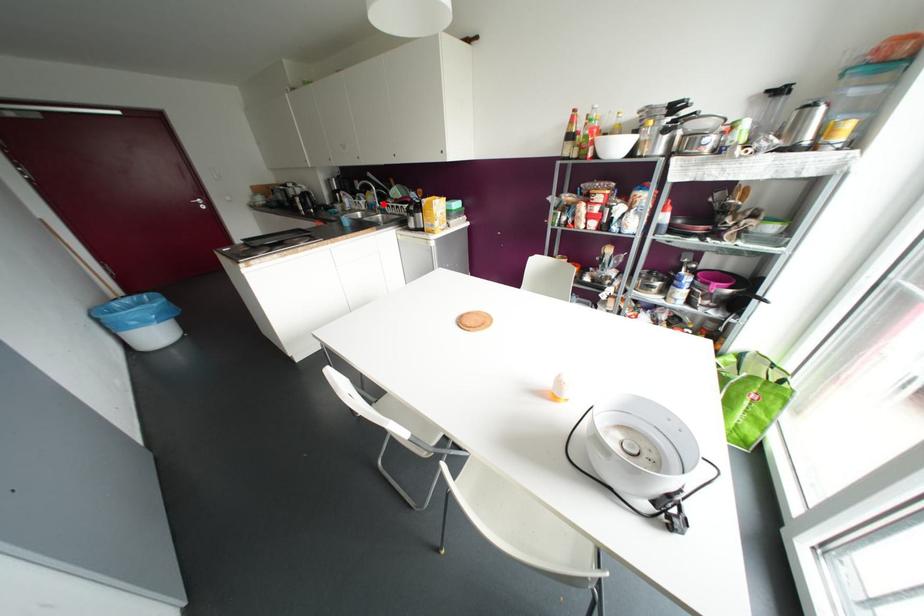
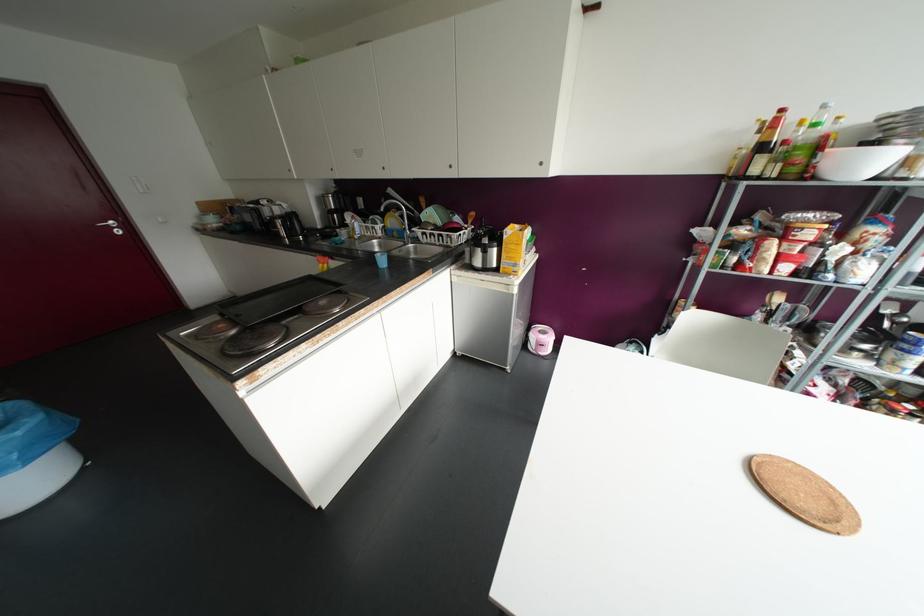
The point at the highlighted location is marked in the first image. Where is the corresponding point in the second image?

(417, 231)